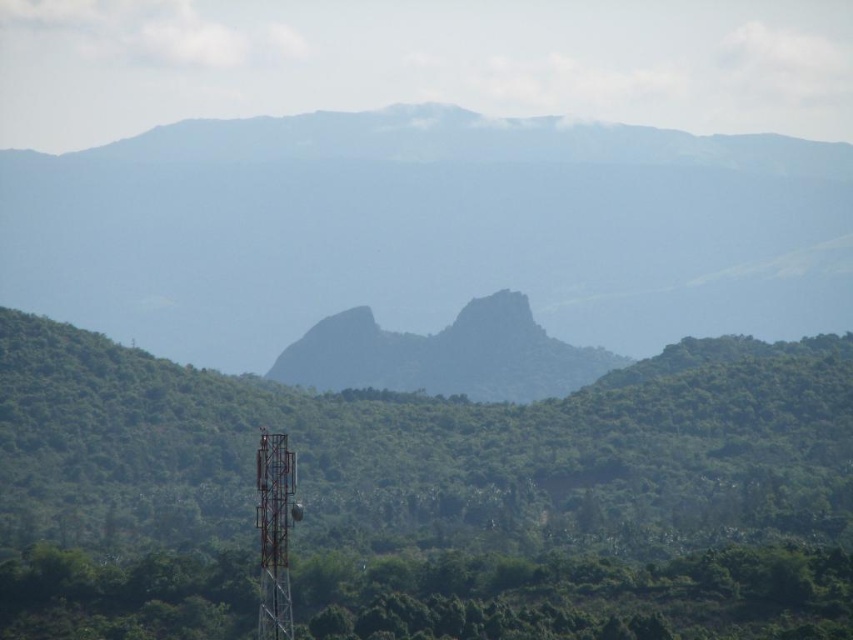
Based on the scene description, where is the green textured mountain at center located in terms of its 2D coordinates?

The green textured mountain at center is located at the 2D coordinates of point (427, 230).

You are a hiker standing at point A and want to reach point B. The coordinates of point A are point A at (93, 177) and point B at (294, 518). According to the map, which point is closer to you?

Point A at (93, 177) is behind point B at (294, 518), so point B is closer to you.

You are an environmental scientist assessing the landscape. You observe the green textured mountain at center and the green rough rock at center. Which of these two features is taller?

The green textured mountain at center is taller than the green rough rock at center.